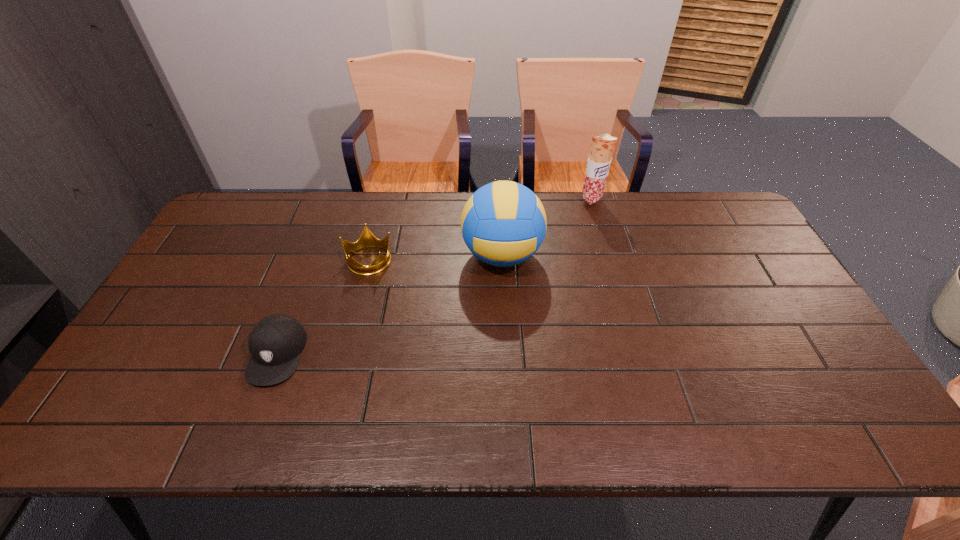
Locate an element on the screen. This screenshot has width=960, height=540. burrito is located at coordinates (602, 147).

Locate an element on the screen. the farthest object is located at coordinates (602, 147).

The height and width of the screenshot is (540, 960). In order to click on the third object from left to right in this screenshot , I will do `click(503, 223)`.

Locate an element on the screen. the nearest object is located at coordinates point(275,343).

Identify the location of the leftmost object. (275, 343).

I want to click on crown, so click(x=367, y=239).

You are a GUI agent. You are given a task and a screenshot of the screen. Output one action in this format:
    pyautogui.click(x=<x>, y=<y>)
    Task: Click on the vacant space situated on the left of the burrito
    
    Given the screenshot: What is the action you would take?
    pyautogui.click(x=541, y=200)

Find the location of `vacant space situated on the back of the third object from left to right`. vacant space situated on the back of the third object from left to right is located at coordinates (500, 218).

Find the location of a particular element. The width and height of the screenshot is (960, 540). vacant space located 0.120m on the front-facing side of the cap is located at coordinates (245, 437).

Locate an element on the screen. This screenshot has width=960, height=540. vacant space located on the right of the crown is located at coordinates (487, 259).